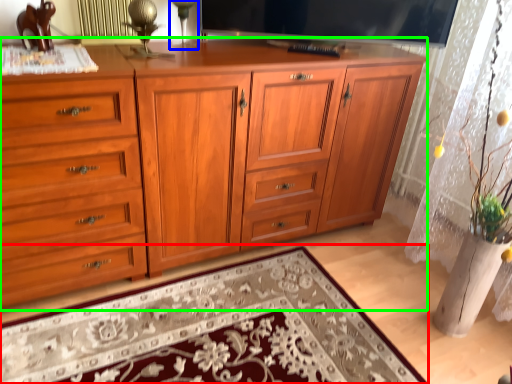
Question: Estimate the real-world distances between objects in this image. Which object is farther from mat (highlighted by a red box), table lamp (highlighted by a blue box) or chest of drawers (highlighted by a green box)?

Choices:
 (A) table lamp
 (B) chest of drawers

Answer: (A)